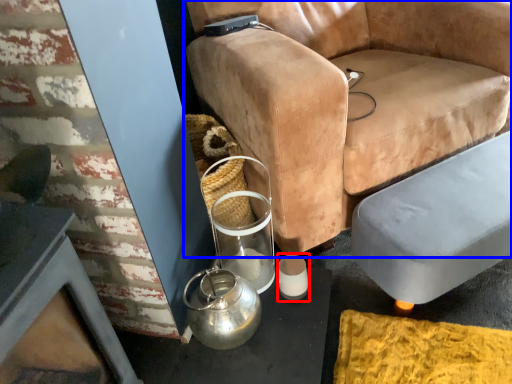
Question: Which of the following is the farthest to the observer, candle holder (highlighted by a red box) or chair (highlighted by a blue box)?

Choices:
 (A) candle holder
 (B) chair

Answer: (A)